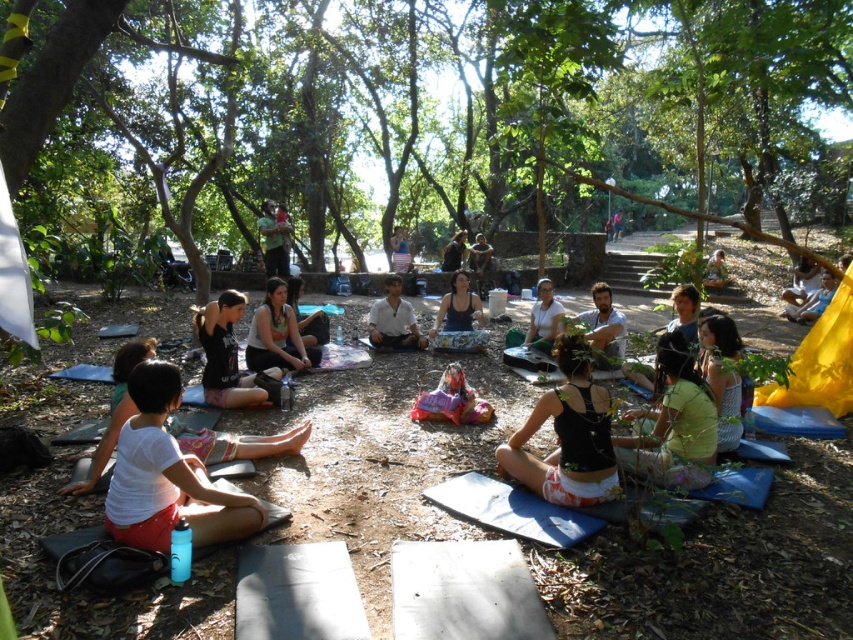
Is black fabric tank top at center positioned in front of knitted light blue sweater at lower right?

No.

How much distance is there between black fabric tank top at center and knitted light blue sweater at lower right?

11.34 feet

Identify the location of black fabric tank top at center. (225, 355).

Which is below, white fabric shirt at lower left or matte gray shirt at center?

white fabric shirt at lower left is below.

Is white fabric shirt at lower left shorter than matte gray shirt at center?

In fact, white fabric shirt at lower left may be taller than matte gray shirt at center.

Does point (137, 449) come in front of point (599, 298)?

Yes, point (137, 449) is closer to viewer.

Where is `white fabric shirt at lower left`? white fabric shirt at lower left is located at coordinates (167, 476).

Does black fabric shorts at center have a smaller size compared to matte black tank top at lower right?

Correct, black fabric shorts at center occupies less space than matte black tank top at lower right.

Is black fabric shorts at center shorter than matte black tank top at lower right?

No, black fabric shorts at center is not shorter than matte black tank top at lower right.

Find the location of a particular element. The height and width of the screenshot is (640, 853). black fabric shorts at center is located at coordinates (567, 435).

Locate an element on the screen. The height and width of the screenshot is (640, 853). black fabric shorts at center is located at coordinates (567, 435).